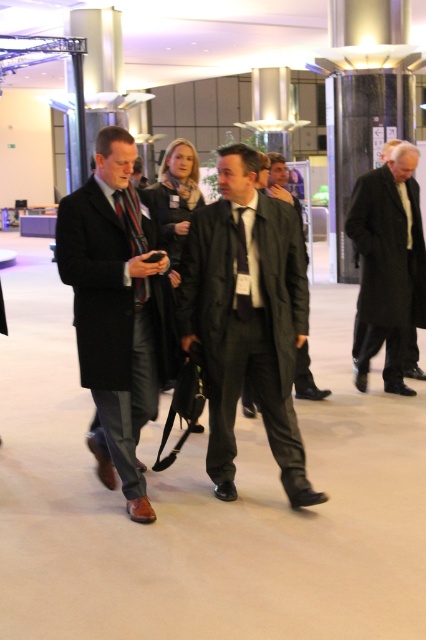
You are a photographer at the event and want to capture a photo of the matte black coat at center and the black silk tie at center. Which object should you focus on first if you want to ensure both are in focus without adjusting the camera settings?

The matte black coat at center is much taller than the black silk tie at center, so focusing on the matte black coat at center first will ensure both are in focus since it is farther away and requires a deeper depth of field.

You are standing in the modern indoor space and need to locate the black wool coat at right. According to the coordinates provided, where exactly is it positioned?

The black wool coat at right is located at point coordinates 0.412 on the x axis and 0.913 on the y axis.

You are a photographer positioned at the entrance of the conference center. You want to capture a photo of the matte black coat at center and the black silk tie at center. Which object will appear larger in the photo?

The matte black coat at center will appear larger in the photo because it is closer to the viewer than the black silk tie at center.